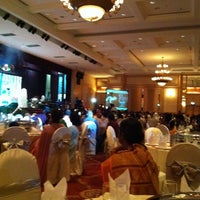
Locate an element on the screen. The width and height of the screenshot is (200, 200). screen with person it it is located at coordinates (120, 101).